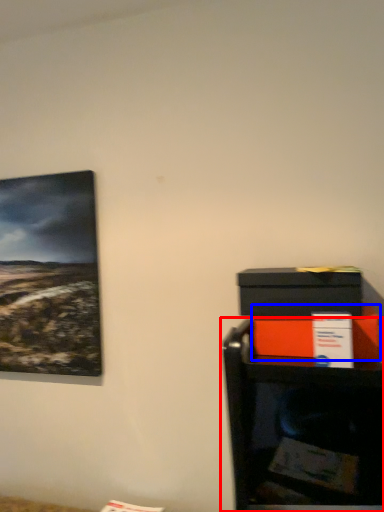
Question: Which of the following is the closest to the observer, furniture (highlighted by a red box) or box (highlighted by a blue box)?

Choices:
 (A) furniture
 (B) box

Answer: (B)